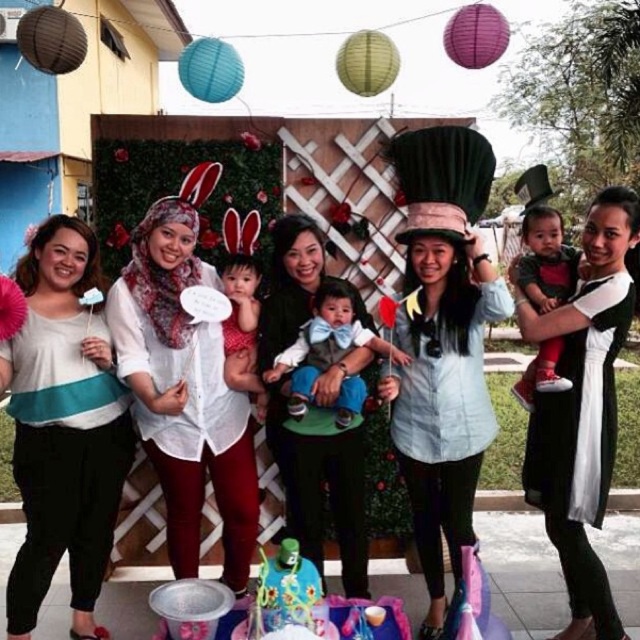
You are standing at the center of the gathering and want to take a photo. There are two points marked in the image. The first point is at coordinates point (x=54, y=547) and the second point is at point (x=285, y=371). Which point is closer to you?

Point (x=54, y=547) is in front of point (x=285, y=371), so the first point is closer to you.

You are a photographer trying to capture a clear shot of the denim shirt at center and the light brown fabric baby at center. Which object should you focus on first to ensure both are in focus?

The denim shirt at center is closer to the viewer than the light brown fabric baby at center, so you should focus on the denim shirt at center first to ensure both are in focus.

You are a photographer at the center of the scene and want to ensure that both the denim shirt at center and the light brown fabric baby at center are clearly visible in your photo. Which object should you focus on first to ensure depth of field captures both?

The denim shirt at center is positioned under light brown fabric baby at center, so you should focus on the light brown fabric baby at center first to ensure both are in focus.